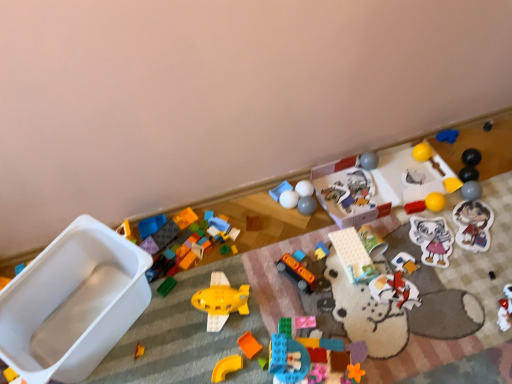
The width and height of the screenshot is (512, 384). Identify the location of free space between yellow plastic curve at center, the fifth toy in the left-to-right sequence, and matte gray ball at right, the 2th toy from the right. (368, 269).